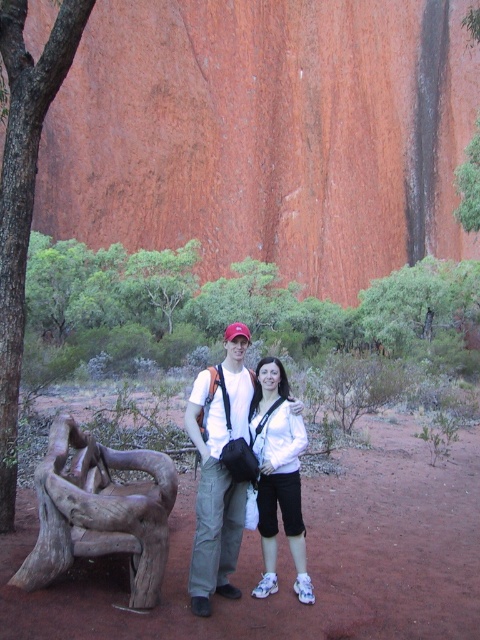
From the picture: Between matte white shirt at center and white matte shirt at center, which one is positioned lower?

white matte shirt at center is lower down.

Is point (214, 548) farther from viewer compared to point (252, 433)?

No, it is in front of (252, 433).

Find the location of a particular element. The image size is (480, 640). matte white shirt at center is located at coordinates (218, 468).

Which is below, smooth bark tree trunk at left or white matte shirt at center?

white matte shirt at center

Is smooth bark tree trunk at left thinner than white matte shirt at center?

No.

Is point (26, 97) positioned before point (309, 596)?

No, it is not.

Find the location of a particular element. The height and width of the screenshot is (640, 480). smooth bark tree trunk at left is located at coordinates (24, 196).

Is point (0, 314) positioned in front of point (207, 467)?

That is False.

Between point (56, 29) and point (200, 433), which one is positioned in front?

Point (200, 433)

Who is more forward, (20, 12) or (294, 410)?

Point (294, 410) is more forward.

Locate an element on the screen. smooth bark tree trunk at left is located at coordinates (24, 196).